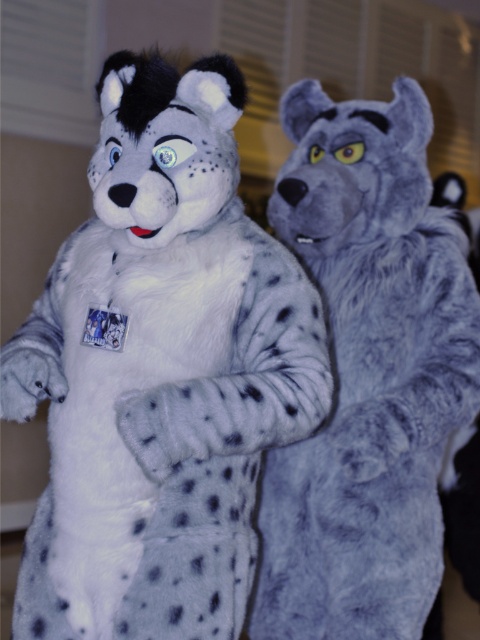
Question: Which point appears farthest from the camera in this image?

Choices:
 (A) (467, 394)
 (B) (110, 449)

Answer: (A)

Question: Is white soft plush toy at center smaller than fuzzy gray wolf at right?

Choices:
 (A) no
 (B) yes

Answer: (B)

Question: Does white soft plush toy at center have a smaller size compared to fuzzy gray wolf at right?

Choices:
 (A) no
 (B) yes

Answer: (B)

Question: Which point is closer to the camera taking this photo?

Choices:
 (A) (261, 540)
 (B) (254, 300)

Answer: (B)

Question: Observing the image, what is the correct spatial positioning of white soft plush toy at center in reference to fuzzy gray wolf at right?

Choices:
 (A) below
 (B) above

Answer: (B)